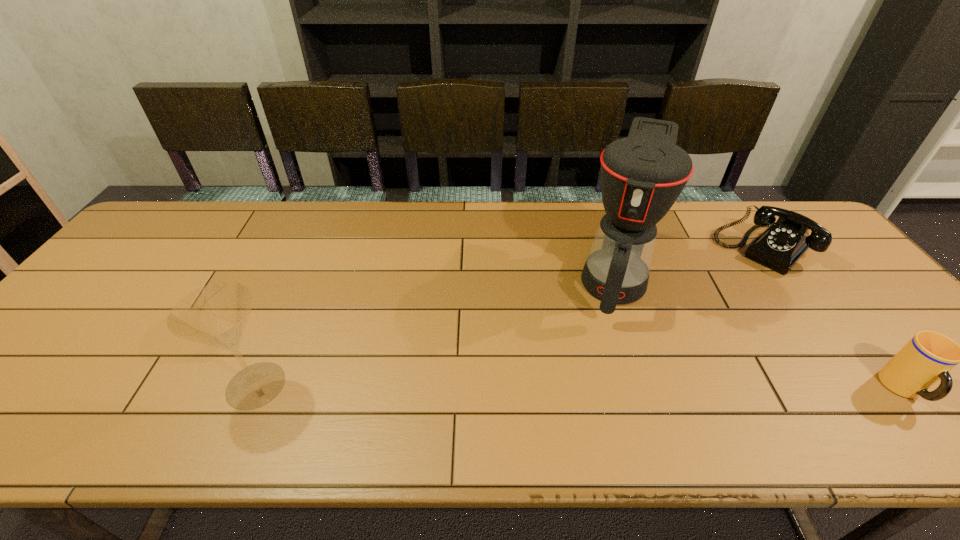
Find the location of a particular element. The image size is (960, 540). object at the near right corner is located at coordinates (928, 357).

Where is `free point at the far edge`? Image resolution: width=960 pixels, height=540 pixels. free point at the far edge is located at coordinates click(242, 225).

Image resolution: width=960 pixels, height=540 pixels. What are the coordinates of `free space at the near edge of the desktop` in the screenshot? It's located at (861, 388).

Find the location of a particular element. The width and height of the screenshot is (960, 540). blank space at the left edge of the desktop is located at coordinates (79, 312).

You are a GUI agent. You are given a task and a screenshot of the screen. Output one action in this format:
    pyautogui.click(x=<x>, y=<y>)
    Task: Click on the free region at the far left corner of the desktop
    This screenshot has height=540, width=960.
    Given the screenshot: What is the action you would take?
    pyautogui.click(x=185, y=228)

What are the coordinates of `unoccupied area between the coffee maker and the cup` in the screenshot? It's located at (760, 333).

At what (x,y) coordinates should I click in order to perform the action: click on free spot between the leftmost object and the coffee maker. Please return your answer as a coordinate pair (x, y). This screenshot has height=540, width=960. Looking at the image, I should click on (436, 331).

Identify the location of empty space between the flute glass and the telephone. Image resolution: width=960 pixels, height=540 pixels. (510, 317).

The height and width of the screenshot is (540, 960). I want to click on vacant point located between the telephone and the tallest object, so click(x=689, y=263).

This screenshot has width=960, height=540. I want to click on free space between the leftmost object and the tallest object, so click(x=436, y=331).